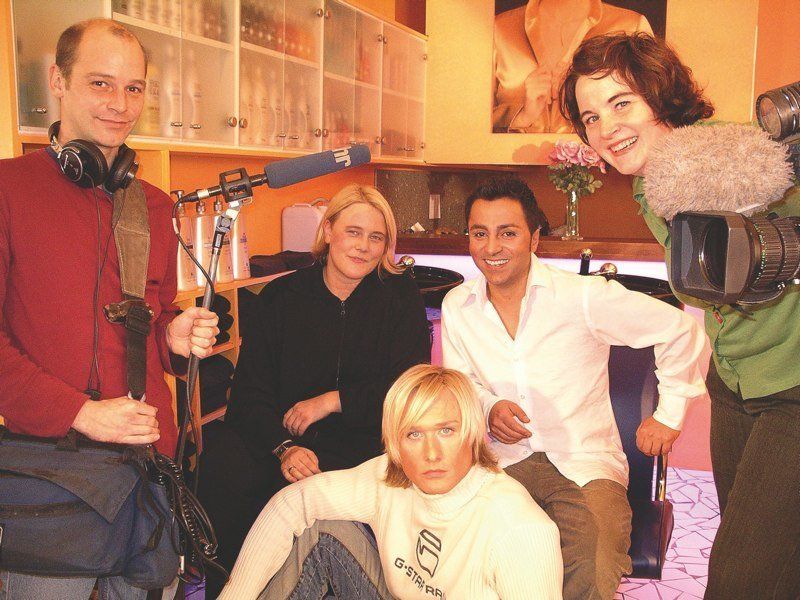
At what (x,y) coordinates should I click in order to perform the action: click on flowers in a clear vase. Please return your answer as a coordinate pair (x, y). The height and width of the screenshot is (600, 800). Looking at the image, I should click on (566, 182).